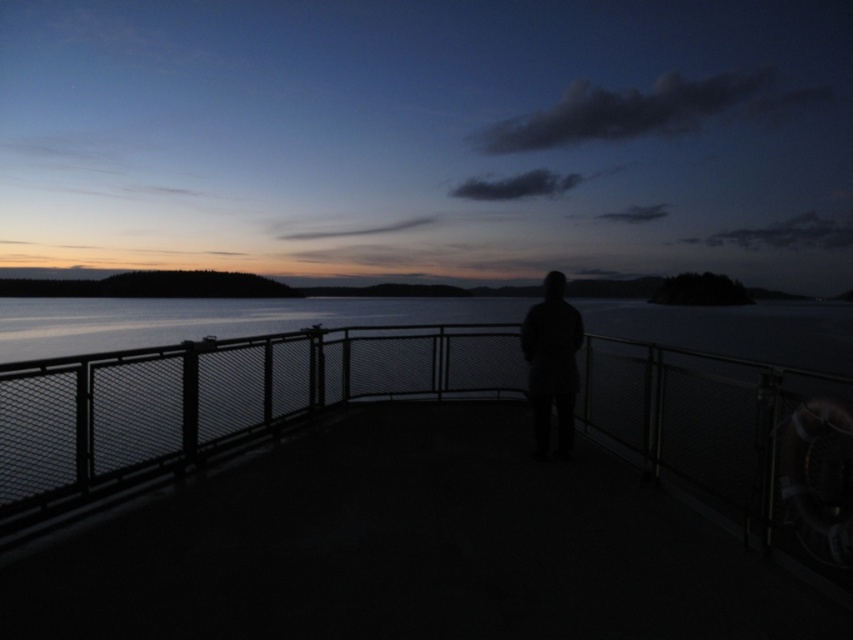
Is silhouette person at center to the right of metal mesh fence at center from the viewer's perspective?

Correct, you'll find silhouette person at center to the right of metal mesh fence at center.

Does silhouette person at center have a greater width compared to metal mesh fence at center?

Yes, silhouette person at center is wider than metal mesh fence at center.

This screenshot has width=853, height=640. What do you see at coordinates (428, 138) in the screenshot?
I see `silhouette person at center` at bounding box center [428, 138].

Identify the location of silhouette person at center. (428, 138).

Can you confirm if silhouette person at center is positioned to the left of dark matte figure at center?

Yes, silhouette person at center is to the left of dark matte figure at center.

Can you confirm if silhouette person at center is smaller than dark matte figure at center?

No.

Locate an element on the screen. The height and width of the screenshot is (640, 853). silhouette person at center is located at coordinates (428, 138).

This screenshot has width=853, height=640. What do you see at coordinates (213, 401) in the screenshot?
I see `metal mesh fence at center` at bounding box center [213, 401].

Find the location of a particular element. metal mesh fence at center is located at coordinates (213, 401).

Identify the location of metal mesh fence at center. (213, 401).